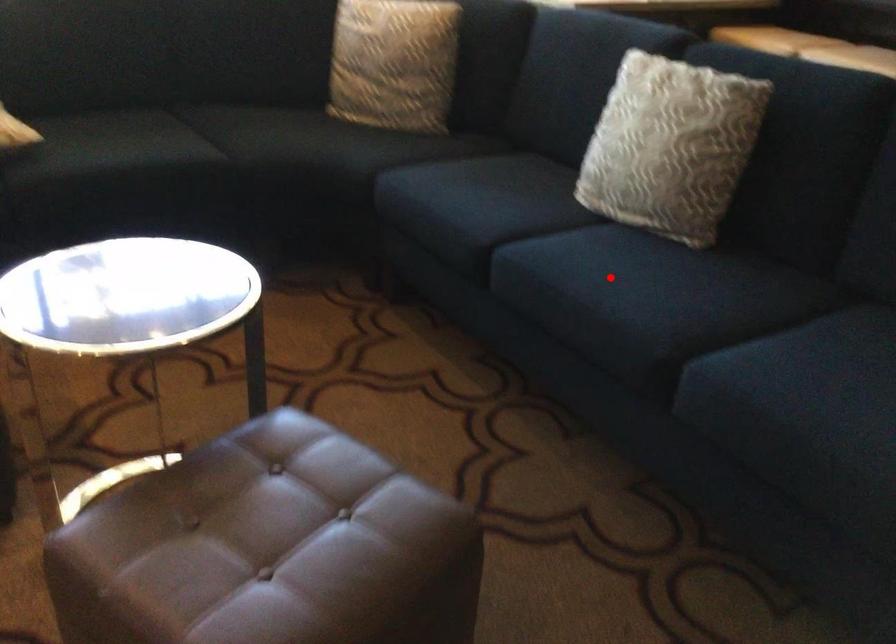
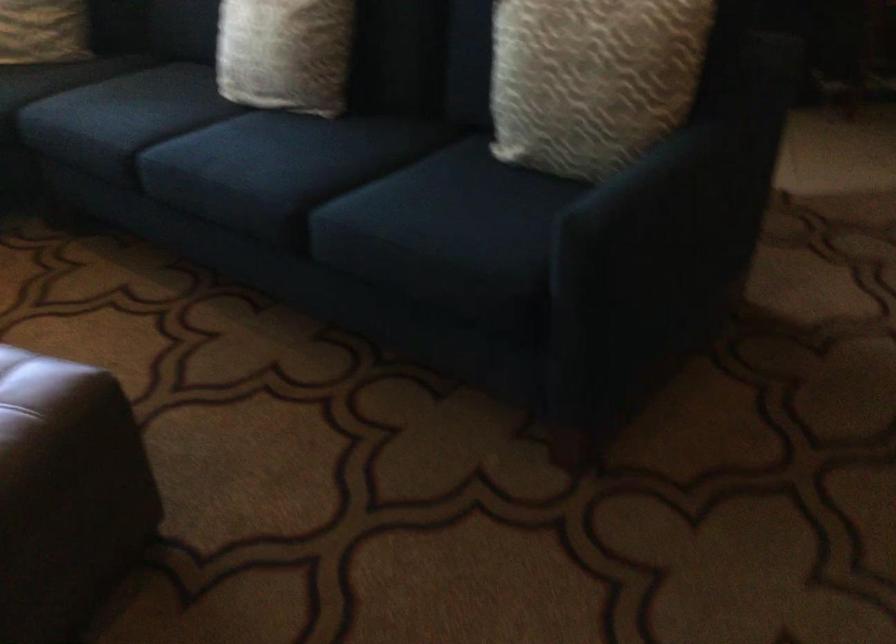
Where in the second image is the point corresponding to the highlighted location from the first image?

(245, 154)